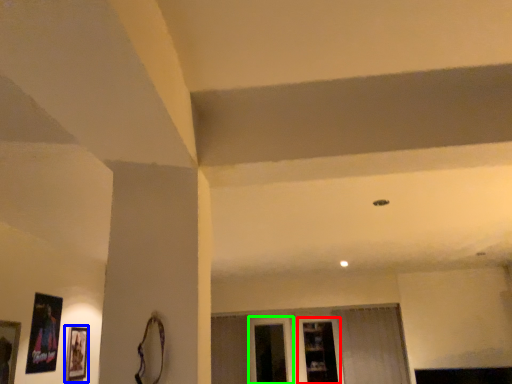
Question: Based on their relative distances, which object is farther from shelf (highlighted by a red box)? Choose from picture frame (highlighted by a blue box) and window (highlighted by a green box).

Choices:
 (A) picture frame
 (B) window

Answer: (A)